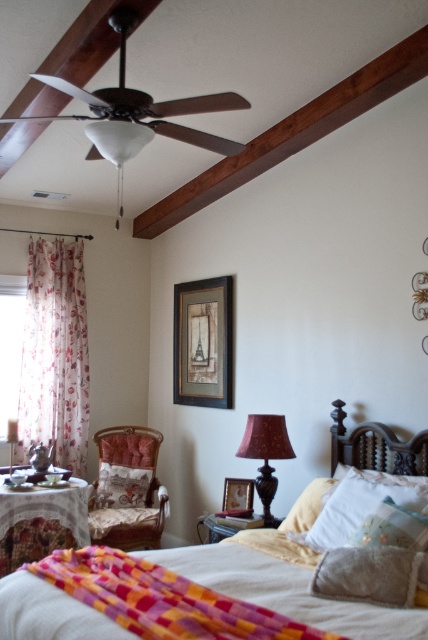
Question: Can you confirm if matte brown lamp at center is positioned to the right of white matte lampshade at center?

Choices:
 (A) no
 (B) yes

Answer: (B)

Question: Which object appears farthest from the camera in this image?

Choices:
 (A) floral sheer curtain at left
 (B) white matte lampshade at center
 (C) clear glass window at left
 (D) velvet upholstered armchair at center

Answer: (A)

Question: Can you confirm if fuzzy gray pillow at center is bigger than wooden picture frame at center?

Choices:
 (A) no
 (B) yes

Answer: (B)

Question: Which point appears farthest from the camera in this image?

Choices:
 (A) [x=107, y=481]
 (B) [x=152, y=132]
 (C) [x=24, y=358]

Answer: (C)

Question: Does soft yellow fabric bed at center come behind velvet cushion at center?

Choices:
 (A) yes
 (B) no

Answer: (B)

Question: Among these points, which one is nearest to the camera?

Choices:
 (A) (366, 508)
 (B) (152, 625)
 (C) (133, 144)

Answer: (B)